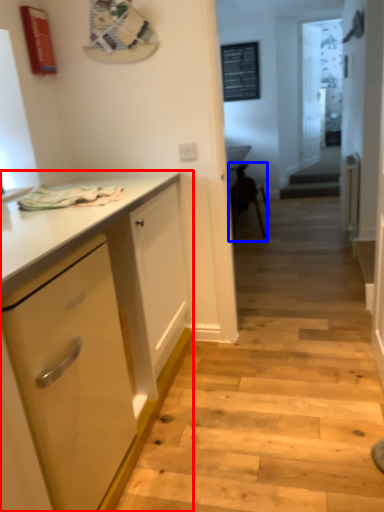
Question: Which object is closer to the camera taking this photo, cabinetry (highlighted by a red box) or chair (highlighted by a blue box)?

Choices:
 (A) cabinetry
 (B) chair

Answer: (A)